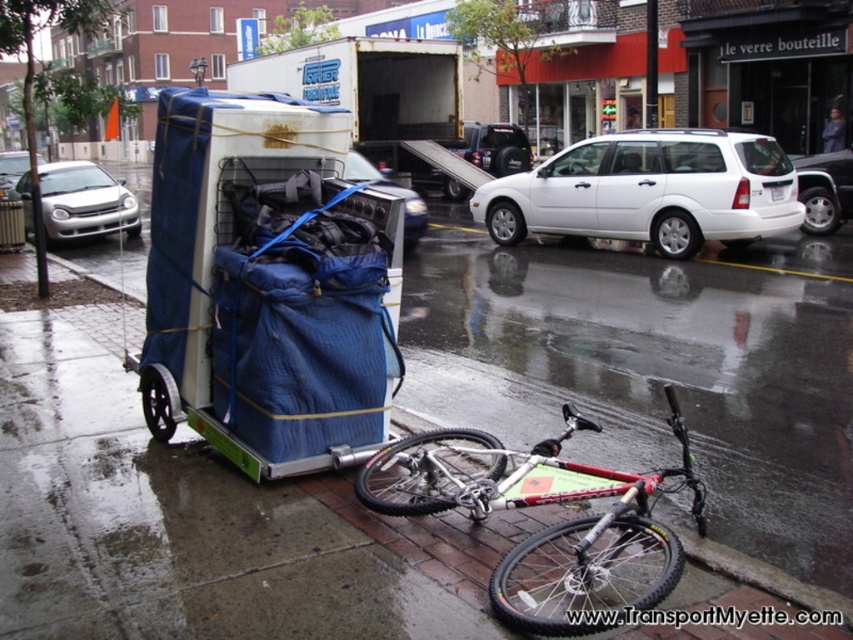
Which is below, shiny metallic bicycle at lower center or white matte station wagon at center?

shiny metallic bicycle at lower center is lower down.

Does shiny metallic bicycle at lower center have a greater width compared to white matte station wagon at center?

No, shiny metallic bicycle at lower center is not wider than white matte station wagon at center.

Which is behind, point (646, 525) or point (700, 134)?

Point (700, 134)

The image size is (853, 640). Find the location of `shiny metallic bicycle at lower center`. shiny metallic bicycle at lower center is located at coordinates (547, 525).

Who is positioned more to the right, shiny metallic bicycle at lower center or silver metallic sedan at left?

From the viewer's perspective, shiny metallic bicycle at lower center appears more on the right side.

In the scene shown: Who is more distant from viewer, (x=509, y=593) or (x=16, y=166)?

The point (x=16, y=166) is behind.

I want to click on shiny metallic bicycle at lower center, so click(x=547, y=525).

Is point (346, 163) closer to camera compared to point (1, 177)?

Yes.

Is metallic blue suitcase at center above silver metallic sedan at left?

No, metallic blue suitcase at center is not above silver metallic sedan at left.

Is point (351, 179) positioned before point (24, 152)?

Yes, it is in front of point (24, 152).

In order to click on metallic blue suitcase at center in this screenshot , I will do `click(390, 193)`.